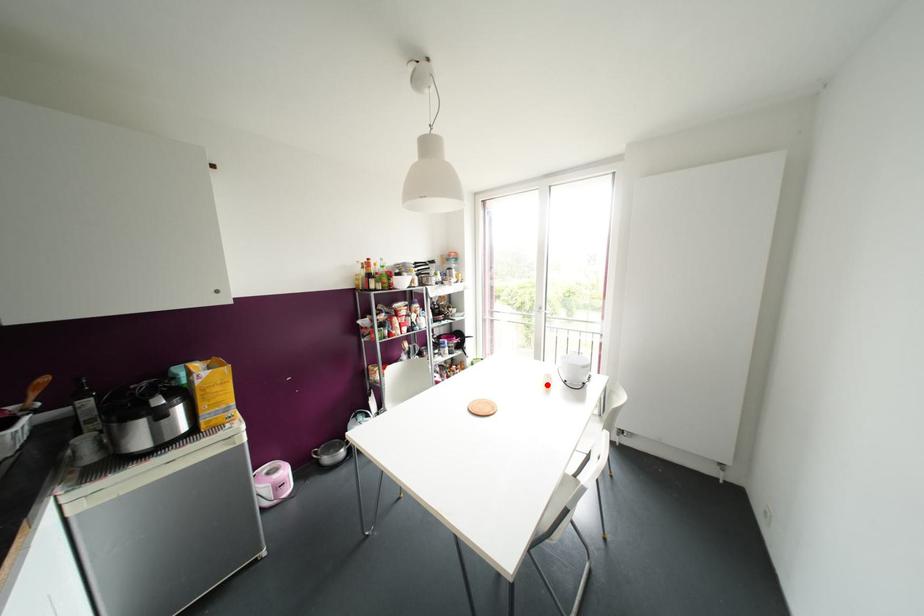
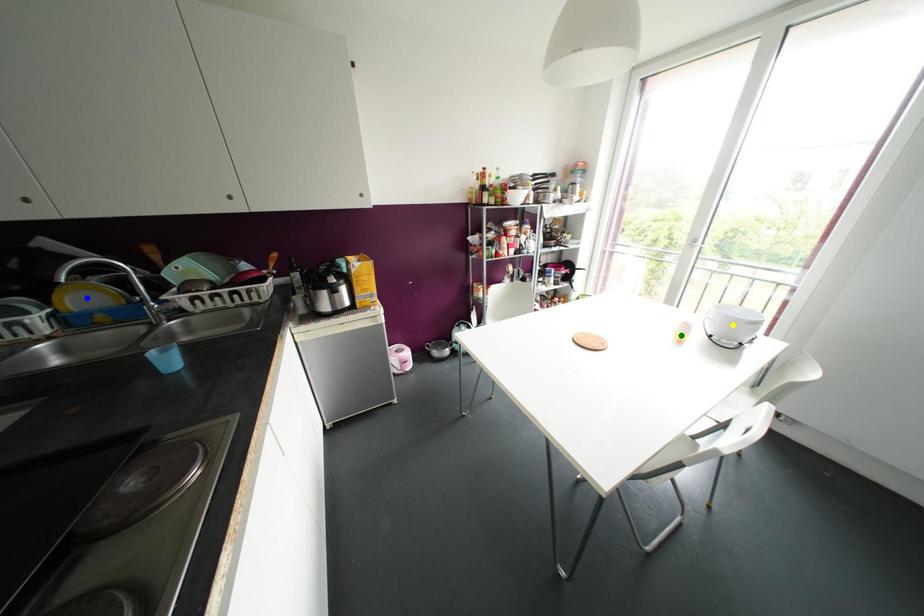
Question: I am providing you with two images of the same scene from different viewpoints. A red point is marked on the first image. You are given multiple points on the second image. Can you choose the point in image 2 that corresponds to the point in image 1?

Choices:
 (A) yellow point
 (B) blue point
 (C) green point

Answer: (C)